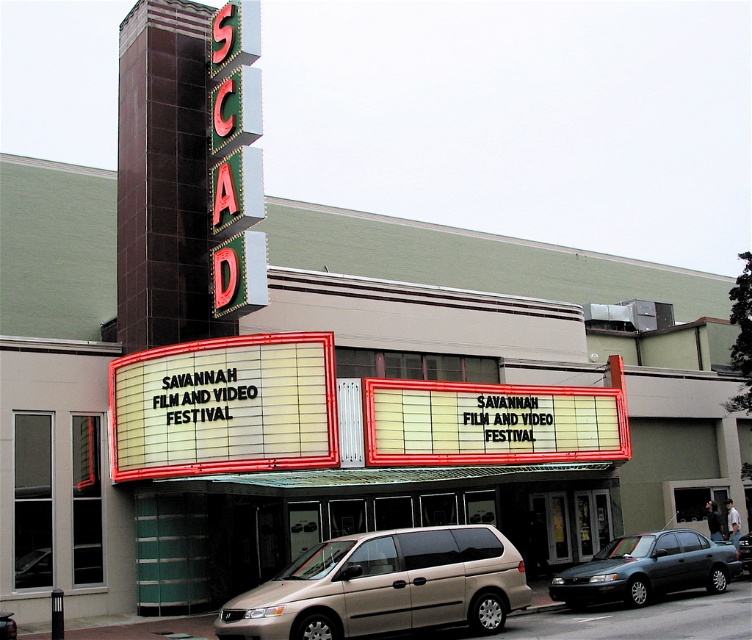
Question: Which point is farther to the camera?

Choices:
 (A) (566, 602)
 (B) (267, 625)
 (C) (135, 364)

Answer: (C)

Question: Which is nearer to the gold metallic minivan at lower center?

Choices:
 (A) metallic green sedan at center
 (B) white marquee sign at center

Answer: (A)

Question: Observing the image, what is the correct spatial positioning of gold metallic minivan at lower center in reference to metallic green sedan at center?

Choices:
 (A) above
 (B) below

Answer: (A)

Question: Which object appears closest to the camera in this image?

Choices:
 (A) gold metallic minivan at lower center
 (B) white marquee sign at center
 (C) metallic green sedan at center

Answer: (A)

Question: Is white marquee sign at center behind metallic green sedan at center?

Choices:
 (A) no
 (B) yes

Answer: (B)

Question: Is the position of white marquee sign at center less distant than that of gold metallic minivan at lower center?

Choices:
 (A) yes
 (B) no

Answer: (B)